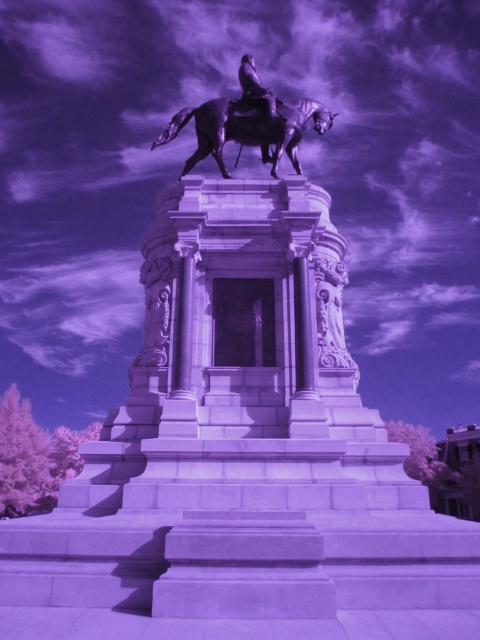
Consider the image. Does polished bronze horse at center have a greater height compared to white marble statue at upper right?

Indeed, polished bronze horse at center has a greater height compared to white marble statue at upper right.

Can you confirm if polished bronze horse at center is bigger than white marble statue at upper right?

Yes.

You are a GUI agent. You are given a task and a screenshot of the screen. Output one action in this format:
    pyautogui.click(x=<x>, y=<y>)
    Task: Click on the polished bronze horse at center
    The height and width of the screenshot is (640, 480).
    Given the screenshot: What is the action you would take?
    pyautogui.click(x=248, y=129)

Find the location of `polished bronze horse at center`. polished bronze horse at center is located at coordinates (248, 129).

Who is more forward, (326,289) or (244,93)?

Positioned in front is point (326,289).

The width and height of the screenshot is (480, 640). I want to click on white marble statue at upper right, so click(x=331, y=314).

Can you confirm if polished bronze horse at center is bigger than shiny bronze horse at upper center?

No, polished bronze horse at center is not bigger than shiny bronze horse at upper center.

Does polished bronze horse at center have a greater width compared to shiny bronze horse at upper center?

Yes.

Is point (290, 129) positioned behind point (254, 77)?

No, it is not.

Find the location of a particular element. This screenshot has width=480, height=640. polished bronze horse at center is located at coordinates (248, 129).